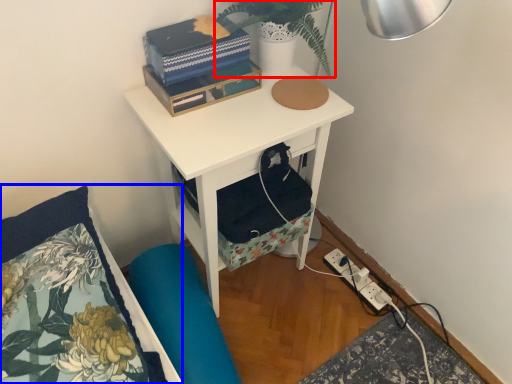
Question: Which of the following is the farthest to the observer, plant (highlighted by a red box) or pillow (highlighted by a blue box)?

Choices:
 (A) plant
 (B) pillow

Answer: (A)